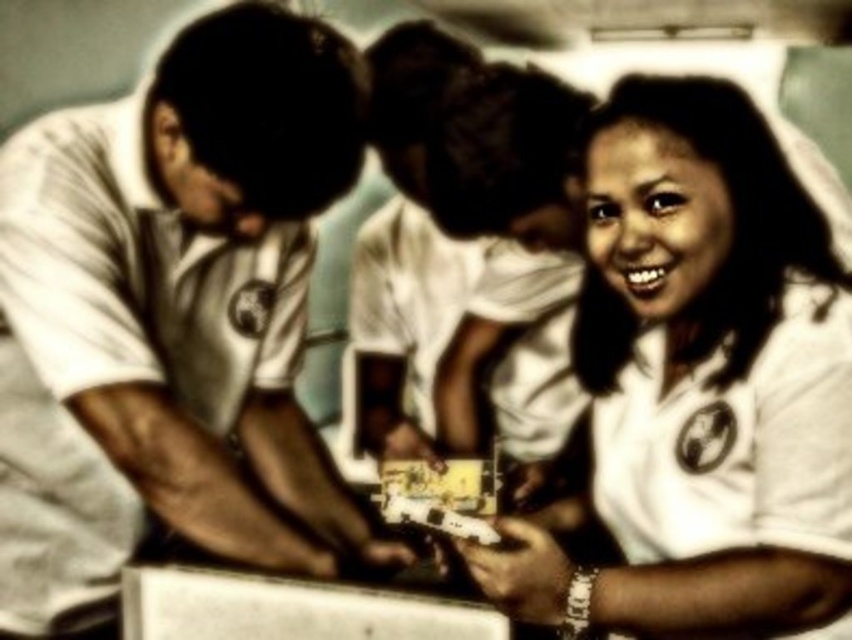
Is white matte shirt at left above white matte shirt at center?

Indeed, white matte shirt at left is positioned over white matte shirt at center.

Is point (231, 172) closer to camera compared to point (602, 316)?

Yes, it is.

Which is behind, point (199, 397) or point (816, 477)?

Point (199, 397)

Identify the location of white matte shirt at left. This screenshot has height=640, width=852. (194, 280).